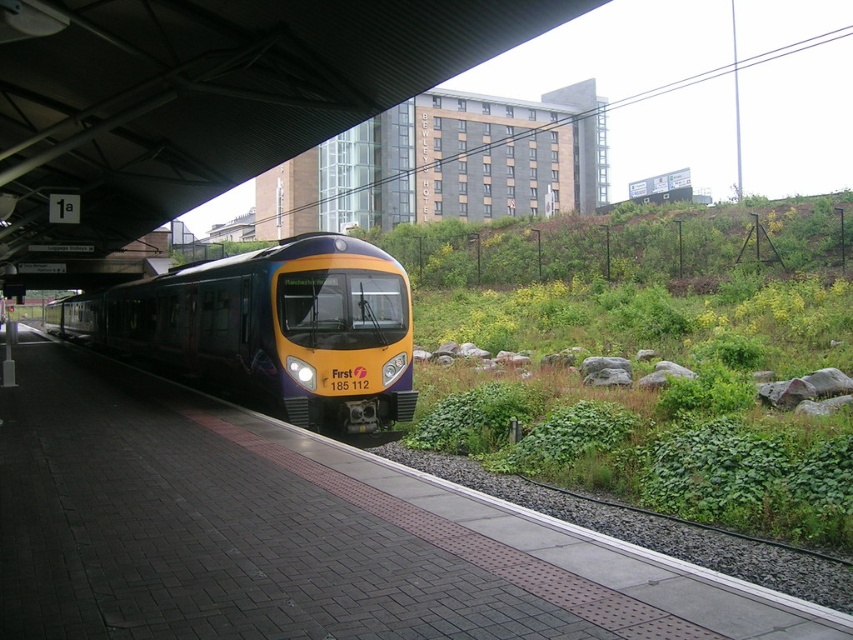
You are standing on the train station platform and want to locate the brick platform at center. Where should you look according to the coordinates provided?

The brick platform at center is located at coordinates point (x=302, y=534).

You are standing at the camera position looking at the train station platform. There is a point marked at coordinates point (x=231, y=596). Can you reach that point from your current position without moving more than 4 meters?

The distance between point (x=231, y=596) and the camera is 4.29 meters. Since 4.29 meters is greater than 4 meters, you cannot reach that point without moving more than 4 meters.